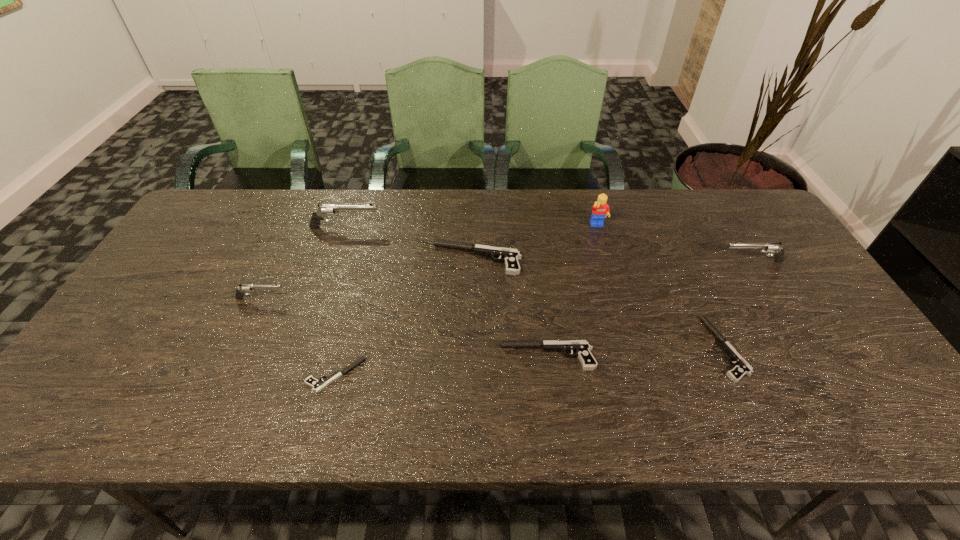
Locate an element on the screen. The width and height of the screenshot is (960, 540). the tallest object is located at coordinates (600, 210).

Where is `the sixth object from left to right`? The width and height of the screenshot is (960, 540). the sixth object from left to right is located at coordinates (600, 210).

Find the location of `the farthest pistol`. the farthest pistol is located at coordinates (324, 210).

I want to click on the biggest silver pistol, so click(x=324, y=210).

You are a GUI agent. You are given a task and a screenshot of the screen. Output one action in this format:
    pyautogui.click(x=<x>, y=<y>)
    Task: Click on the second nearest silver pistol
    
    Given the screenshot: What is the action you would take?
    pyautogui.click(x=774, y=248)

At what (x,y) coordinates should I click in order to perform the action: click on the second tallest pistol. Please return your answer as a coordinate pair (x, y). Looking at the image, I should click on (774, 248).

Locate an element on the screen. This screenshot has height=540, width=960. the fifth farthest object is located at coordinates pos(240,291).

You are a GUI agent. You are given a task and a screenshot of the screen. Output one action in this format:
    pyautogui.click(x=<x>, y=<y>)
    Task: Click on the fifth shortest object
    
    Given the screenshot: What is the action you would take?
    pyautogui.click(x=240, y=291)

I want to click on the farthest black pistol, so click(509, 256).

Where is `the fourth shortest object`? The image size is (960, 540). the fourth shortest object is located at coordinates (509, 256).